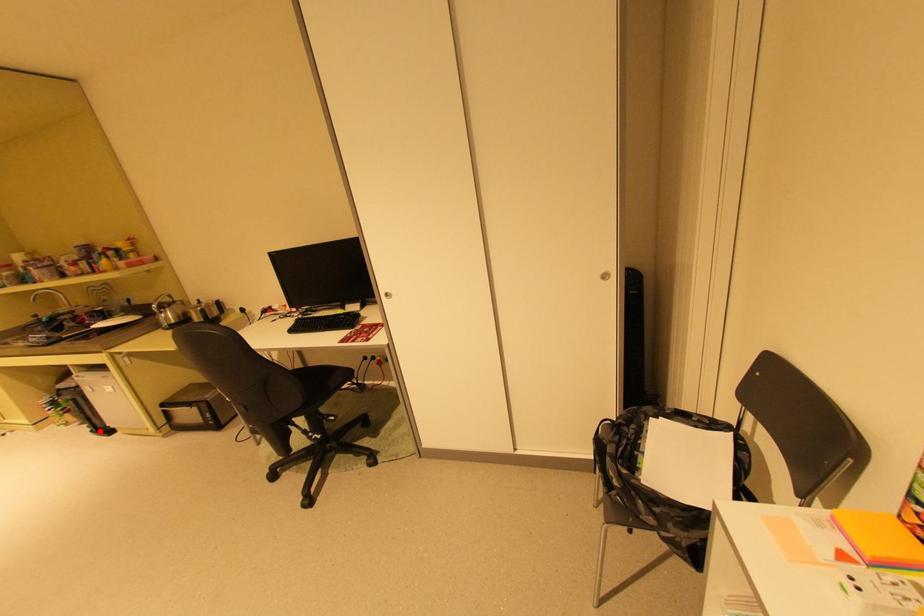
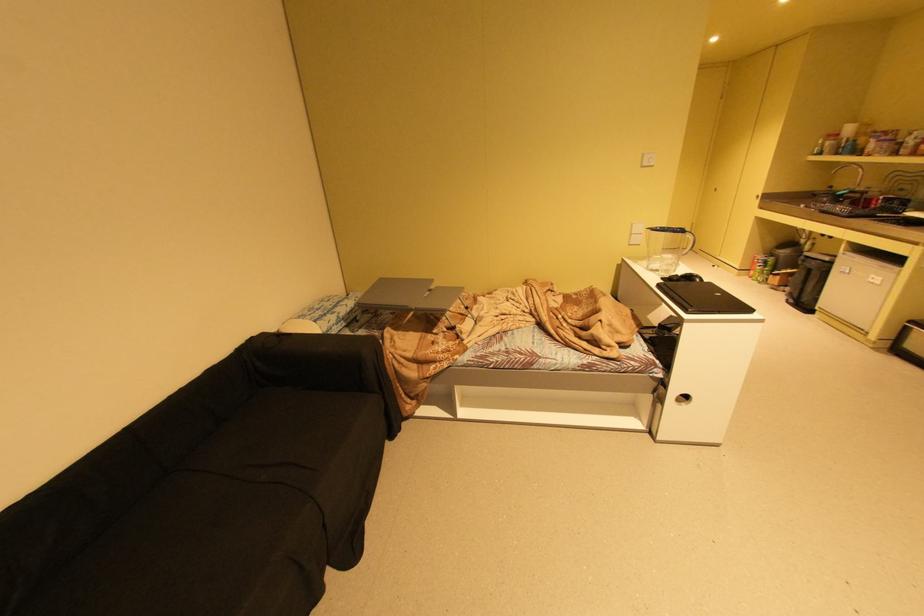
Question: I am providing you with two images of the same scene from different viewpoints. Given a red point in image1, look at the same physical point in image2. Is it:

Choices:
 (A) Closer to the viewpoint
 (B) Farther from the viewpoint

Answer: (B)